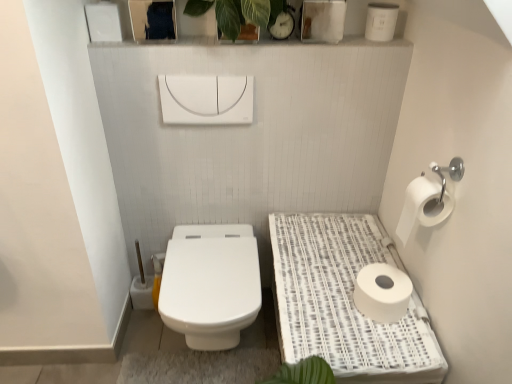
Identify the location of vacant space behind white matte toilet paper at lower right, acting as the first toilet paper starting from the bottom. This screenshot has width=512, height=384. (357, 259).